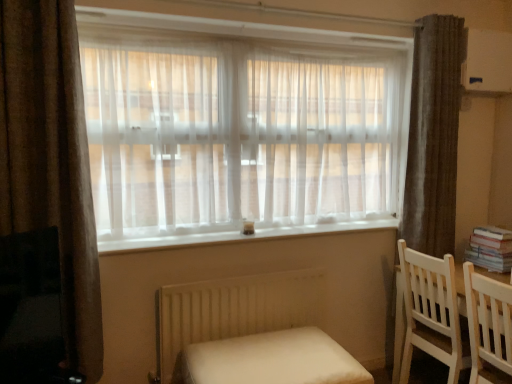
Question: Could you tell me if white fabric bed at lower center is facing white paper book at right?

Choices:
 (A) no
 (B) yes

Answer: (A)

Question: Does white fabric bed at lower center come behind white paper book at right?

Choices:
 (A) no
 (B) yes

Answer: (A)

Question: Can white paper book at right be found inside white fabric bed at lower center?

Choices:
 (A) no
 (B) yes

Answer: (A)

Question: Considering the relative sizes of white fabric bed at lower center and white paper book at right in the image provided, is white fabric bed at lower center smaller than white paper book at right?

Choices:
 (A) no
 (B) yes

Answer: (A)

Question: Considering the relative sizes of white fabric bed at lower center and white paper book at right in the image provided, is white fabric bed at lower center taller than white paper book at right?

Choices:
 (A) yes
 (B) no

Answer: (A)

Question: From the image's perspective, is white fabric bed at lower center below white paper book at right?

Choices:
 (A) no
 (B) yes

Answer: (B)

Question: Is white paper book at right not near white wooden chair at right, the 1th chair in the front-to-back sequence?

Choices:
 (A) yes
 (B) no

Answer: (B)

Question: From a real-world perspective, does white paper book at right stand above white wooden chair at right, the 1th chair in the front-to-back sequence?

Choices:
 (A) yes
 (B) no

Answer: (A)

Question: Does white paper book at right appear on the right side of white wooden chair at right, which is the 2th chair in back-to-front order?

Choices:
 (A) yes
 (B) no

Answer: (A)

Question: From a real-world perspective, is white paper book at right below white wooden chair at right, the 1th chair in the front-to-back sequence?

Choices:
 (A) yes
 (B) no

Answer: (B)

Question: Considering the relative positions of white paper book at right and white wooden chair at right, which is the 2th chair in back-to-front order, in the image provided, is white paper book at right behind white wooden chair at right, which is the 2th chair in back-to-front order,?

Choices:
 (A) no
 (B) yes

Answer: (B)

Question: Does white paper book at right have a greater height compared to white wooden chair at right, the 1th chair in the front-to-back sequence?

Choices:
 (A) yes
 (B) no

Answer: (B)

Question: Could you tell me if white fabric bed at lower center is turned towards white matte radiator at lower center?

Choices:
 (A) yes
 (B) no

Answer: (B)